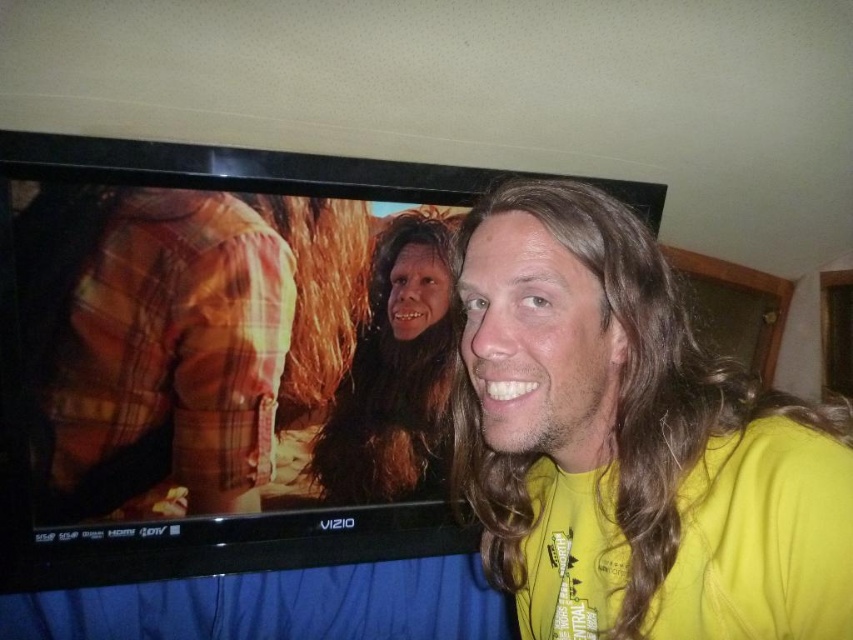
Question: Does black glossy tv at upper left appear on the left side of brown fuzzy hair at center?

Choices:
 (A) yes
 (B) no

Answer: (A)

Question: Which object is positioned closest to the black glossy tv at upper left?

Choices:
 (A) yellow matte shirt at center
 (B) brown fuzzy hair at center

Answer: (B)

Question: Considering the relative positions of yellow matte shirt at center and brown fuzzy hair at center in the image provided, where is yellow matte shirt at center located with respect to brown fuzzy hair at center?

Choices:
 (A) above
 (B) below

Answer: (B)

Question: Which point appears closest to the camera in this image?

Choices:
 (A) (393, 243)
 (B) (114, 150)
 (C) (701, 588)

Answer: (C)

Question: Which is nearer to the yellow matte shirt at center?

Choices:
 (A) black glossy tv at upper left
 (B) brown fuzzy hair at center

Answer: (A)

Question: Does black glossy tv at upper left appear over brown fuzzy hair at center?

Choices:
 (A) yes
 (B) no

Answer: (B)